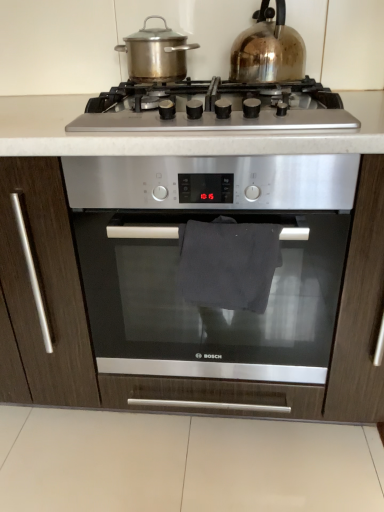
Question: Is shiny metallic kettle at upper right, the 2th kitchen appliance when ordered from left to right, not within satin silver oven at center?

Choices:
 (A) yes
 (B) no

Answer: (A)

Question: From the image's perspective, is shiny metallic kettle at upper right, the 2th kitchen appliance when ordered from left to right, above satin silver oven at center?

Choices:
 (A) no
 (B) yes

Answer: (B)

Question: From a real-world perspective, is shiny metallic kettle at upper right, which is counted as the 1th kitchen appliance, starting from the right, on satin silver oven at center?

Choices:
 (A) no
 (B) yes

Answer: (B)

Question: Does shiny metallic kettle at upper right, which is counted as the 1th kitchen appliance, starting from the right, have a lesser height compared to satin silver oven at center?

Choices:
 (A) yes
 (B) no

Answer: (A)

Question: Is satin silver oven at center located within shiny metallic kettle at upper right, the 2th kitchen appliance when ordered from left to right?

Choices:
 (A) no
 (B) yes

Answer: (A)

Question: Would you say stainless steel pot at upper center, which is counted as the second kitchen appliance, starting from the right, is to the left or to the right of shiny metallic kettle at upper right, the 2th kitchen appliance when ordered from left to right, in the picture?

Choices:
 (A) right
 (B) left

Answer: (B)

Question: Relative to shiny metallic kettle at upper right, which is counted as the 1th kitchen appliance, starting from the right, is stainless steel pot at upper center, which is counted as the second kitchen appliance, starting from the right, in front or behind?

Choices:
 (A) behind
 (B) front

Answer: (A)

Question: In terms of width, does stainless steel pot at upper center, placed as the first kitchen appliance when sorted from left to right, look wider or thinner when compared to shiny metallic kettle at upper right, the 2th kitchen appliance when ordered from left to right?

Choices:
 (A) thin
 (B) wide

Answer: (A)

Question: From a real-world perspective, relative to shiny metallic kettle at upper right, which is counted as the 1th kitchen appliance, starting from the right, is stainless steel pot at upper center, which is counted as the second kitchen appliance, starting from the right, vertically above or below?

Choices:
 (A) below
 (B) above

Answer: (A)

Question: In the image, is satin silver oven at center positioned in front of or behind dark fabric towel at center?

Choices:
 (A) front
 (B) behind

Answer: (A)

Question: Considering the positions of satin silver oven at center and dark fabric towel at center in the image, is satin silver oven at center bigger or smaller than dark fabric towel at center?

Choices:
 (A) small
 (B) big

Answer: (B)

Question: Considering the positions of satin silver oven at center and dark fabric towel at center in the image, is satin silver oven at center wider or thinner than dark fabric towel at center?

Choices:
 (A) thin
 (B) wide

Answer: (B)

Question: Choose the correct answer: Is satin silver oven at center inside dark fabric towel at center or outside it?

Choices:
 (A) inside
 (B) outside

Answer: (B)

Question: From the image's perspective, is satin silver gas stove at center located above or below stainless steel pot at upper center, placed as the first kitchen appliance when sorted from left to right?

Choices:
 (A) above
 (B) below

Answer: (B)

Question: Considering their positions, is satin silver gas stove at center located in front of or behind stainless steel pot at upper center, which is counted as the second kitchen appliance, starting from the right?

Choices:
 (A) front
 (B) behind

Answer: (A)